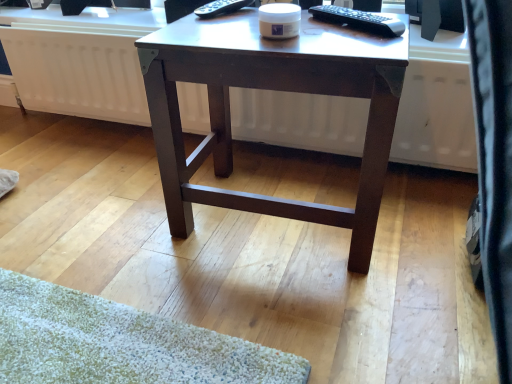
You are a GUI agent. You are given a task and a screenshot of the screen. Output one action in this format:
    pyautogui.click(x=<x>, y=<y>)
    Task: Click on the vacant region under white matte radiator at center (from a real-world perspective)
    
    Given the screenshot: What is the action you would take?
    pyautogui.click(x=85, y=123)